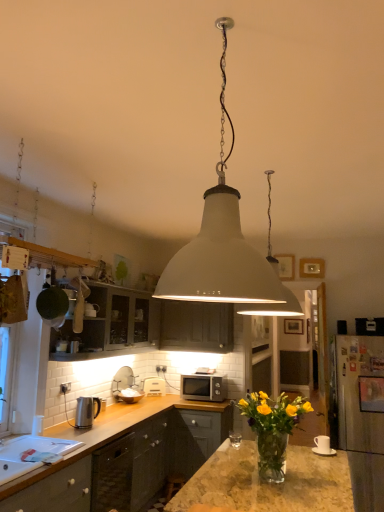
Question: Is white matte pendant light at center, the 2th lamp viewed from the back, to the left or to the right of satin silver microwave at center in the image?

Choices:
 (A) right
 (B) left

Answer: (B)

Question: Relative to satin silver microwave at center, is white matte pendant light at center, positioned as the second lamp in right-to-left order, in front or behind?

Choices:
 (A) front
 (B) behind

Answer: (A)

Question: Which of these objects is positioned closest to the white matte pendant light at center, the 2th lamp viewed from the back?

Choices:
 (A) translucent glass vase at center
 (B) white glossy sink at lower left
 (C) white matte pendant light at center, which is the 2th lamp in front-to-back order
 (D) white plastic electric outlet at center
 (E) satin silver microwave at center

Answer: (C)

Question: Estimate the real-world distances between objects in this image. Which object is farther from the satin silver microwave at center?

Choices:
 (A) white matte microwave at center, the second appliance from the left
 (B) matte dark wood cabinets at upper left, which appears as the first cabinetry when viewed from the left
 (C) white matte pendant light at center, positioned as the second lamp in right-to-left order
 (D) white matte pendant light at center, the first lamp positioned from the right
 (E) white plastic electric outlet at center

Answer: (C)